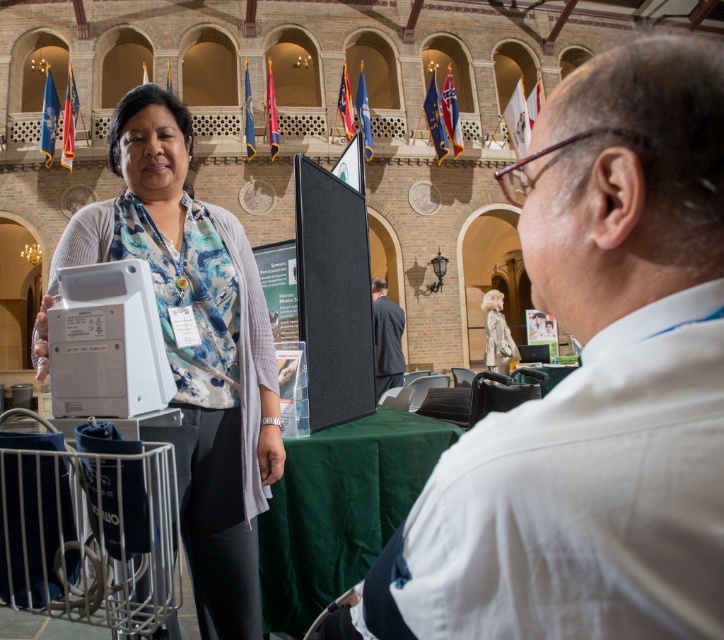
You are attending a conference and see two people in the image. The first is wearing a white shirt at upper right, and the second is wearing a dark gray suit at center. Which person is located more to the right side of the image?

The white shirt at upper right is positioned on the right side of dark gray suit at center, so the person wearing the white shirt at upper right is more to the right.

Based on the scene description, where is the white shirt at upper right located in the image?

The white shirt at upper right is located at point 0.600 on the x axis and 0.823 on the y axis.

You are a photographer positioned at the entrance of the conference hall. You need to capture a photo that includes both the white shirt at upper right and the light beige fabric coat at center. Which object should you focus on first to ensure both are in sharp focus?

You should focus on the white shirt at upper right first since it is closer to the viewer than the light beige fabric coat at center, ensuring both objects are in focus when using depth of field techniques.